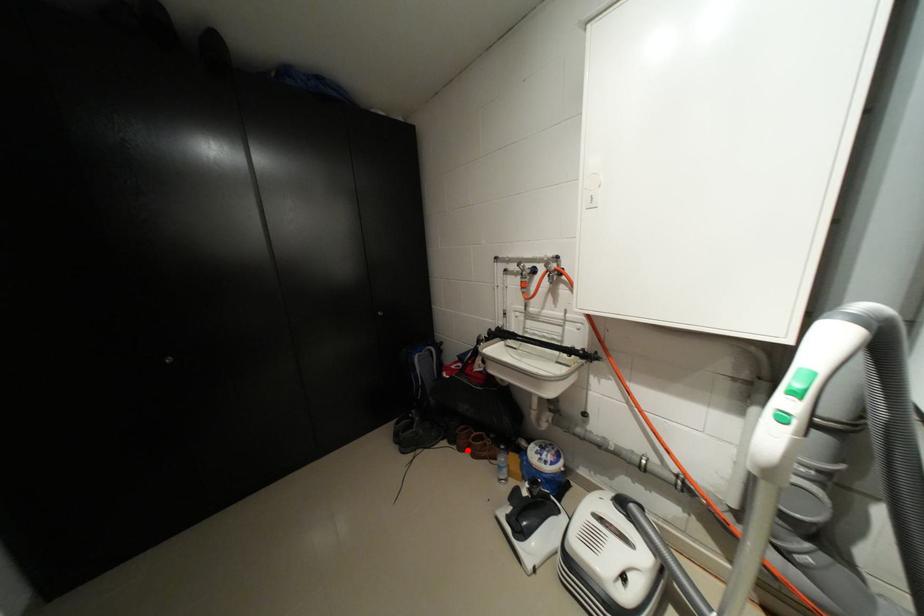
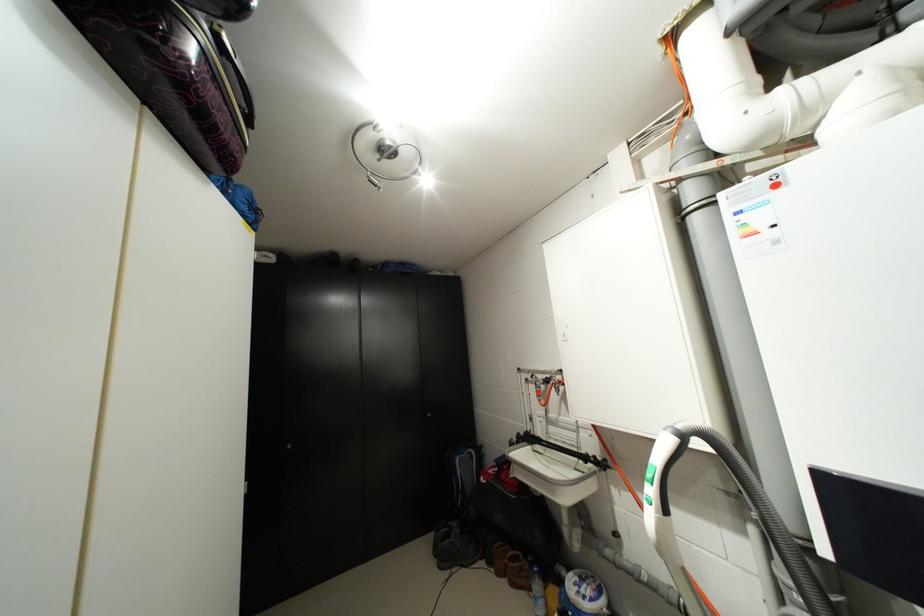
The point at the highlighted location is marked in the first image. Where is the corresponding point in the second image?

(505, 575)